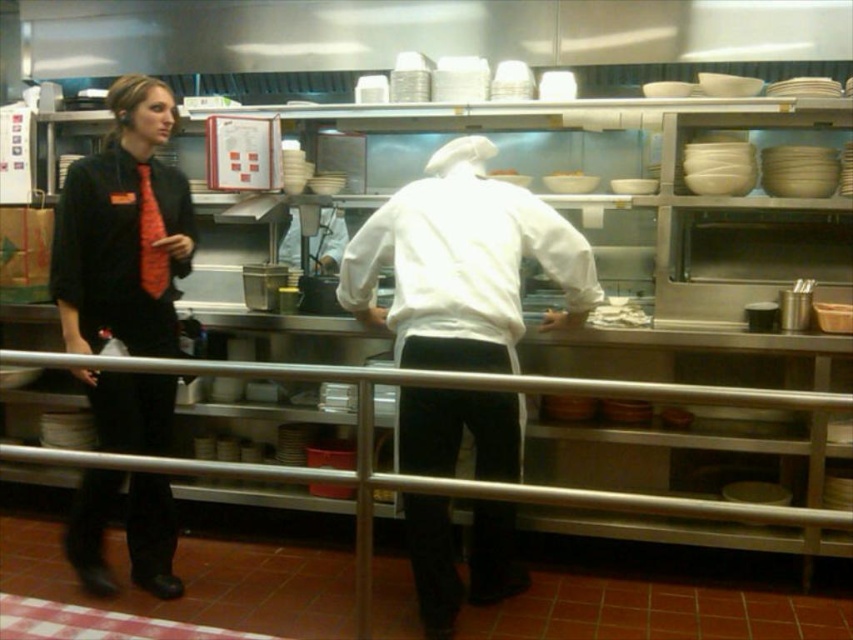
Question: Does white matte chef coat at center appear on the left side of brushed metal rail at center?

Choices:
 (A) no
 (B) yes

Answer: (A)

Question: Does white matte chef coat at center appear over white matte bowl at upper center?

Choices:
 (A) yes
 (B) no

Answer: (B)

Question: Which point appears farthest from the camera in this image?

Choices:
 (A) (643, 396)
 (B) (573, 172)
 (C) (103, 506)
 (D) (454, 349)

Answer: (B)

Question: Which object is positioned closest to the white matte bowl at upper center?

Choices:
 (A) white matte chef coat at center
 (B) matte black jacket at left

Answer: (A)

Question: Can you confirm if matte black jacket at left is wider than brushed metal rail at center?

Choices:
 (A) no
 (B) yes

Answer: (A)

Question: Which of the following is the closest to the observer?

Choices:
 (A) (369, 484)
 (B) (163, 445)
 (C) (486, 353)

Answer: (A)